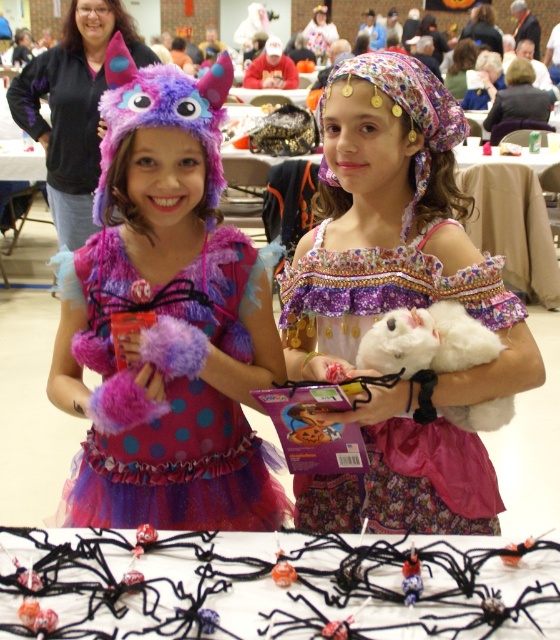
Question: Can you confirm if floral satin dress at center is positioned to the left of white fluffy stuffed animal at center?

Choices:
 (A) yes
 (B) no

Answer: (A)

Question: Does black fabric spider web at lower center have a smaller size compared to pink tulle dress at center?

Choices:
 (A) yes
 (B) no

Answer: (A)

Question: Which point is closer to the camera?

Choices:
 (A) (288, 595)
 (B) (24, 118)
 (C) (338, 522)
 (D) (170, 529)

Answer: (A)

Question: Is black fabric spider web at lower center thinner than white fluffy stuffed animal at center?

Choices:
 (A) no
 (B) yes

Answer: (A)

Question: Which point is farther to the camera?

Choices:
 (A) fuzzy purple monster hat at left
 (B) white fluffy stuffed animal at center

Answer: (A)

Question: Among these points, which one is farthest from the camera?

Choices:
 (A) (259, 630)
 (B) (58, 211)
 (C) (95, 323)
 (D) (452, 328)

Answer: (B)